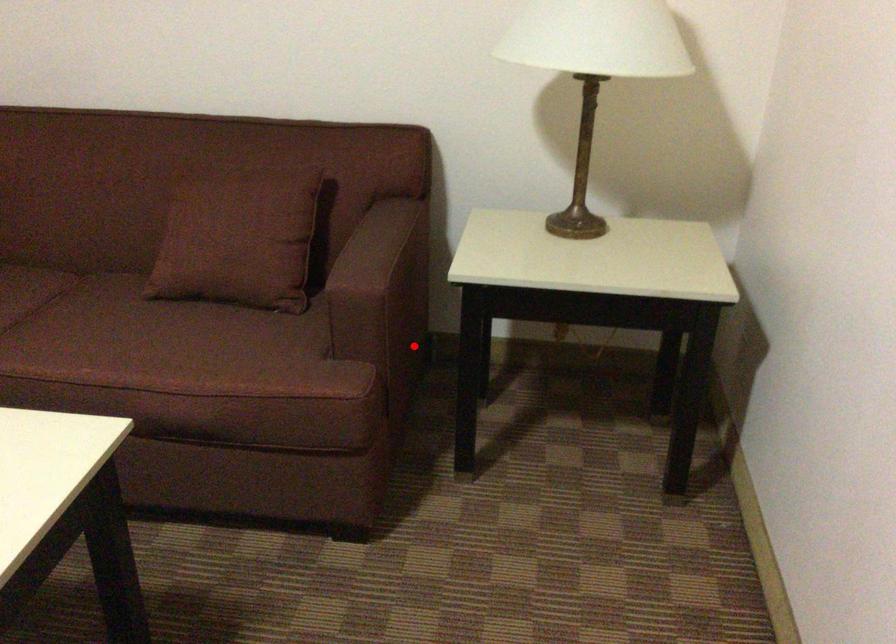
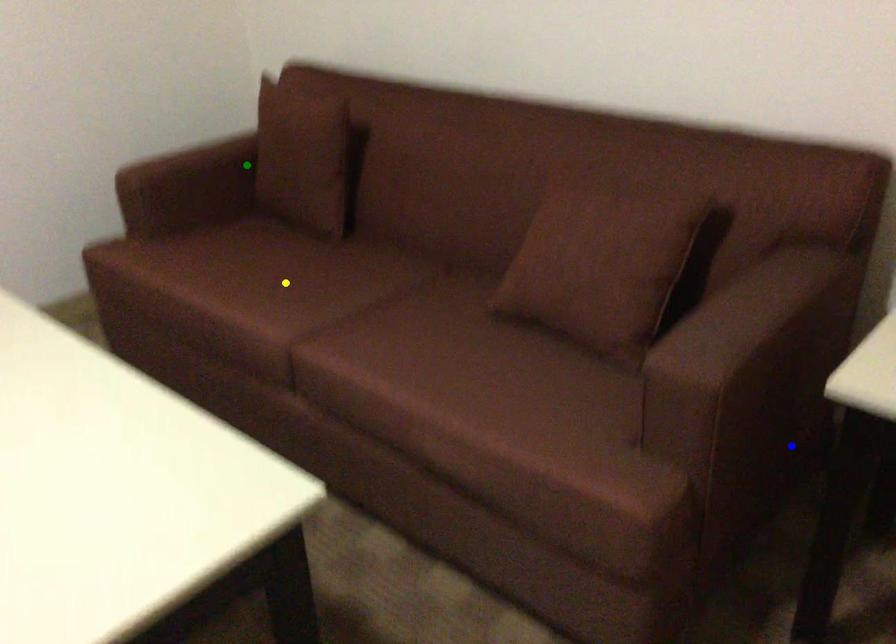
Question: I am providing you with two images of the same scene from different viewpoints. A red point is marked on the first image. You are given multiple points on the second image. Which mark in image 2 goes with the point in image 1?

Choices:
 (A) yellow point
 (B) green point
 (C) blue point

Answer: (C)